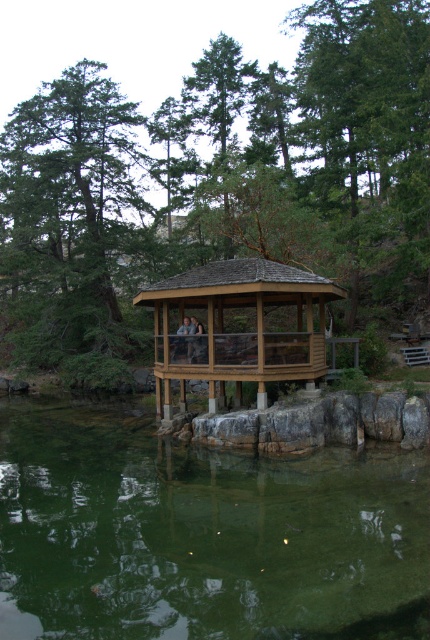
Who is positioned more to the left, brown wooden gazebo at center or green translucent water at lower center?

brown wooden gazebo at center is more to the left.

Is brown wooden gazebo at center above green translucent water at lower center?

Yes, brown wooden gazebo at center is above green translucent water at lower center.

The height and width of the screenshot is (640, 430). I want to click on brown wooden gazebo at center, so click(220, 182).

Does green textured tree at center have a larger size compared to wooden gazebo at center?

Indeed, green textured tree at center has a larger size compared to wooden gazebo at center.

Can you confirm if green textured tree at center is shorter than wooden gazebo at center?

Incorrect, green textured tree at center's height does not fall short of wooden gazebo at center's.

Does point (58, 285) come in front of point (181, 326)?

No.

Where is `green textured tree at center`? green textured tree at center is located at coordinates (68, 211).

Can you confirm if brown wooden gazebo at center is smaller than green textured tree at center?

No, brown wooden gazebo at center is not smaller than green textured tree at center.

This screenshot has width=430, height=640. Find the location of `brown wooden gazebo at center`. brown wooden gazebo at center is located at coordinates (220, 182).

Which is in front, point (424, 86) or point (48, 189)?

Positioned in front is point (424, 86).

At what (x,y) coordinates should I click in order to perform the action: click on brown wooden gazebo at center. Please return your answer as a coordinate pair (x, y). This screenshot has height=640, width=430. Looking at the image, I should click on (220, 182).